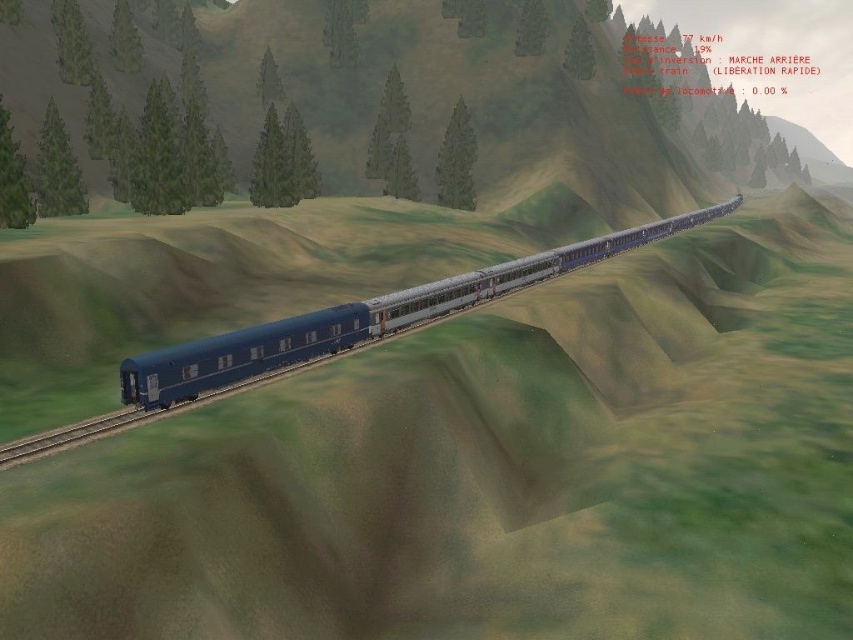
You are standing on a platform and see the metallic blue train at center approaching. The platform is 15 meters long. Will the train pass completely past the platform before stopping?

The metallic blue train at center is 16.34 meters from viewer. Since the platform is only 15 meters long, the train will have already passed the platform by 1.34 meters before stopping.

You are a passenger on the metallic blue train at center. You look down and see the gray metallic train track at lower left. Is the train currently on the track?

Yes, the metallic blue train at center is positioned over the gray metallic train track at lower left, so the train is currently on the track.

You are a passenger on the metallic blue train at center and want to know if the train can fit on the gray metallic train track at lower left. Can it?

The metallic blue train at center might be wider than gray metallic train track at lower left, so there is a possibility that the train cannot fit on the track.